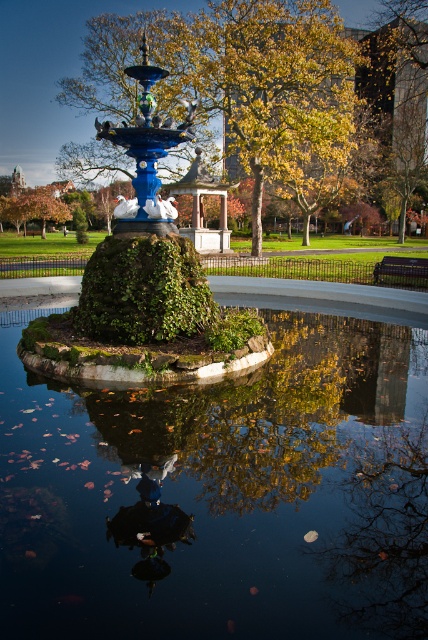
Question: Observing the image, what is the correct spatial positioning of green leafy tree at center in reference to green mossy hedge at center?

Choices:
 (A) right
 (B) left

Answer: (A)

Question: Which point is farther from the camera taking this photo?

Choices:
 (A) (95, 294)
 (B) (157, 227)
 (C) (407, 445)

Answer: (B)

Question: Which object is farther from the camera taking this photo?

Choices:
 (A) blue glossy fountain at center
 (B) transparent glass water at center
 (C) green mossy hedge at center

Answer: (C)

Question: Which object is closer to the camera taking this photo?

Choices:
 (A) blue glossy fountain at center
 (B) green mossy hedge at center
 (C) green leafy tree at center

Answer: (A)

Question: Does blue glossy fountain at center appear under green mossy hedge at center?

Choices:
 (A) yes
 (B) no

Answer: (B)

Question: Does green leafy tree at center appear over blue glossy fountain at center?

Choices:
 (A) yes
 (B) no

Answer: (A)